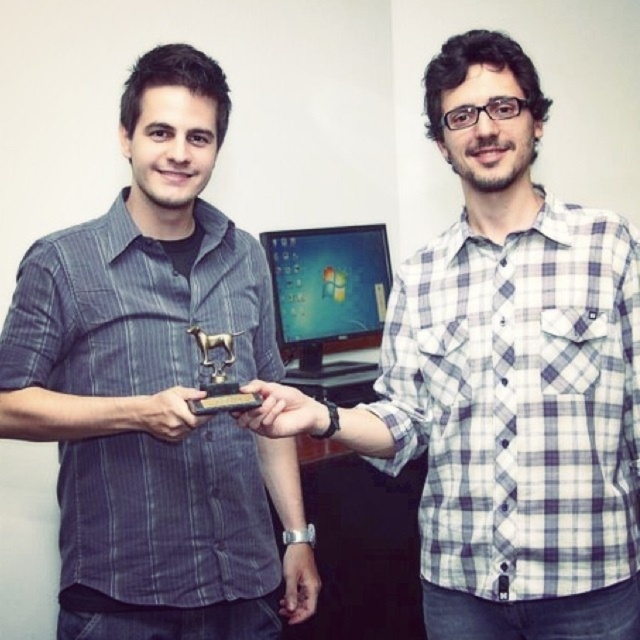
Question: Does matte plastic monitor at center come in front of matte black phone at center?

Choices:
 (A) no
 (B) yes

Answer: (A)

Question: Does white checkered shirt at center have a greater width compared to smooth skin hand at center?

Choices:
 (A) yes
 (B) no

Answer: (A)

Question: Which point is farther from the camera taking this photo?

Choices:
 (A) (445, 413)
 (B) (292, 426)

Answer: (A)

Question: Is matte black trophy at center above matte black phone at center?

Choices:
 (A) yes
 (B) no

Answer: (A)

Question: Which of the following is the farthest from the observer?

Choices:
 (A) white checkered shirt at center
 (B) smooth skin hand at center

Answer: (B)

Question: Which point is closer to the camera taking this photo?

Choices:
 (A) (152, 403)
 (B) (176, 70)
 (C) (353, 420)

Answer: (A)